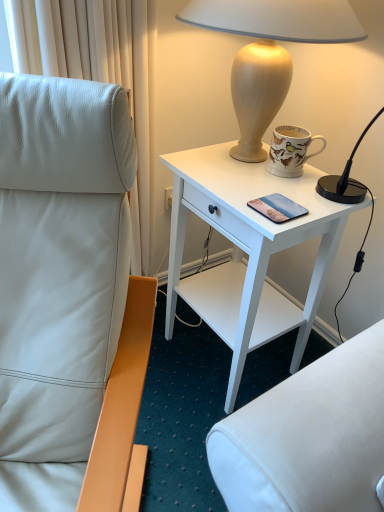
Locate an element on the screen. Image resolution: width=384 pixels, height=512 pixels. free spot to the left of porcelain mug with bird illustrations at upper right is located at coordinates (232, 173).